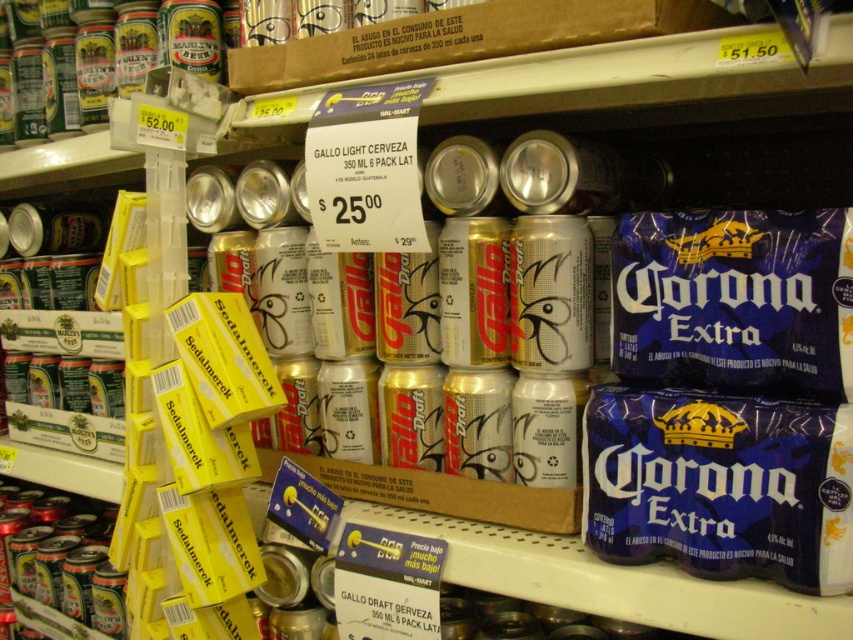
Question: Which point is farther from the camera taking this photo?

Choices:
 (A) (572, 220)
 (B) (509, 257)

Answer: (B)

Question: Among these points, which one is nearest to the camera?

Choices:
 (A) (410, 1)
 (B) (576, 241)
 (C) (529, 324)
 (D) (10, 602)

Answer: (A)

Question: Is silver metallic cans at center to the left of gold metallic can at center from the viewer's perspective?

Choices:
 (A) yes
 (B) no

Answer: (A)

Question: Which object is the closest to the shiny silver can at center?

Choices:
 (A) gold metallic can at center
 (B) gold metallic can at upper center

Answer: (B)

Question: In this image, where is silver metallic cans at center located relative to gold metallic can at center?

Choices:
 (A) below
 (B) above

Answer: (B)

Question: Does shiny silver can at center appear under gold metallic can at center?

Choices:
 (A) yes
 (B) no

Answer: (A)